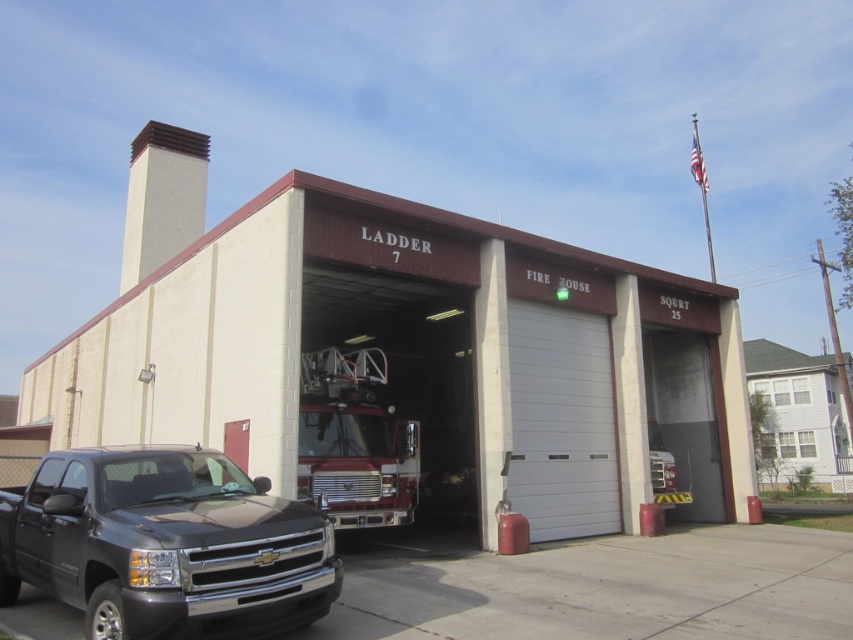
You are standing in front of the fire station and want to take a photo. There are two points marked on the ground at coordinates point (x=154, y=120) and point (x=323, y=456). Which point is closer to your camera position?

Point (x=154, y=120) is further to the camera than point (x=323, y=456), so the point closer to your camera position is point (x=323, y=456).

You are a visitor arriving at the fire station and need to park your car. You see the black glossy pickup truck at lower left and the shiny red fire truck at center. Which vehicle should you avoid parking near to ensure enough space for your car?

You should avoid parking near the black glossy pickup truck at lower left because it is larger in size than the shiny red fire truck at center, requiring more space.